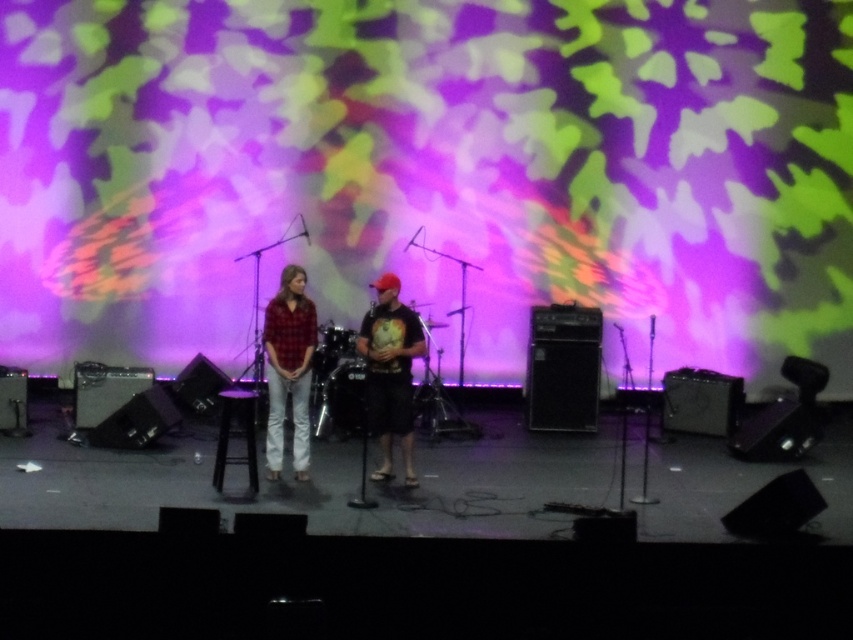
You are a photographer standing at the front of the stage. You want to take a photo that includes both the point at coordinates point (386, 349) and point (294, 416). Which point should you focus on to ensure both are in sharp focus?

You should focus on point (386, 349) because it is closer to the camera, ensuring the other point will also be in focus due to depth of field.